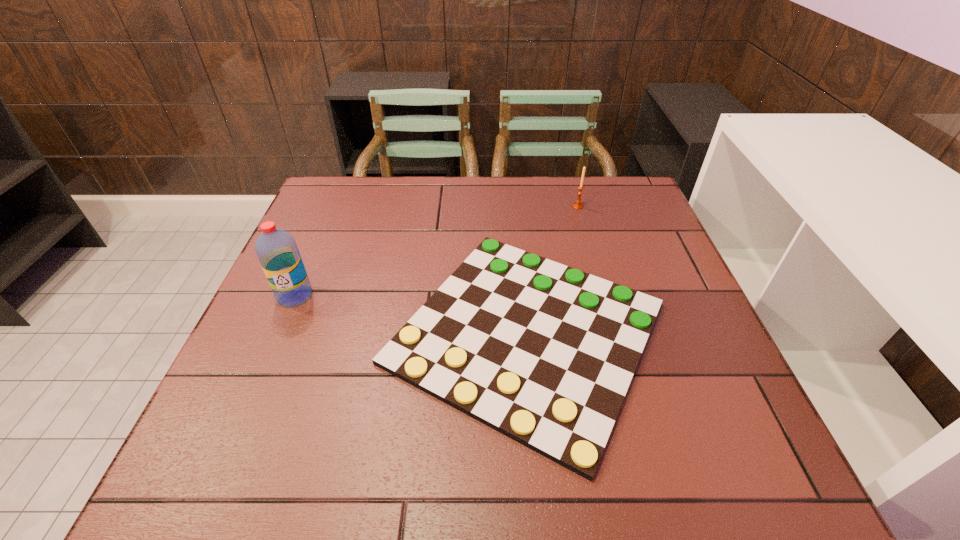
This screenshot has width=960, height=540. What are the coordinates of `object that is at the left edge` in the screenshot? It's located at (277, 251).

This screenshot has height=540, width=960. Find the location of `object that is at the right edge`. object that is at the right edge is located at coordinates (543, 353).

Find the location of a particular element. Image resolution: width=960 pixels, height=540 pixels. object present at the near right corner is located at coordinates (543, 353).

Identify the location of vacant space at the far edge of the desktop. (508, 203).

This screenshot has height=540, width=960. I want to click on vacant region at the near edge, so click(x=431, y=470).

I want to click on vacant area at the left edge of the desktop, so click(x=207, y=417).

At what (x,y) coordinates should I click in order to perform the action: click on vacant space at the right edge of the desktop. Please return your answer as a coordinate pair (x, y). Looking at the image, I should click on (660, 265).

At what (x,y) coordinates should I click in order to perform the action: click on free region at the far left corner of the desktop. Please return your answer as a coordinate pair (x, y). Looking at the image, I should click on (355, 210).

Locate an element on the screen. free spot at the near left corner of the desktop is located at coordinates (204, 460).

In order to click on free location at the near right corner in this screenshot , I will do `click(774, 474)`.